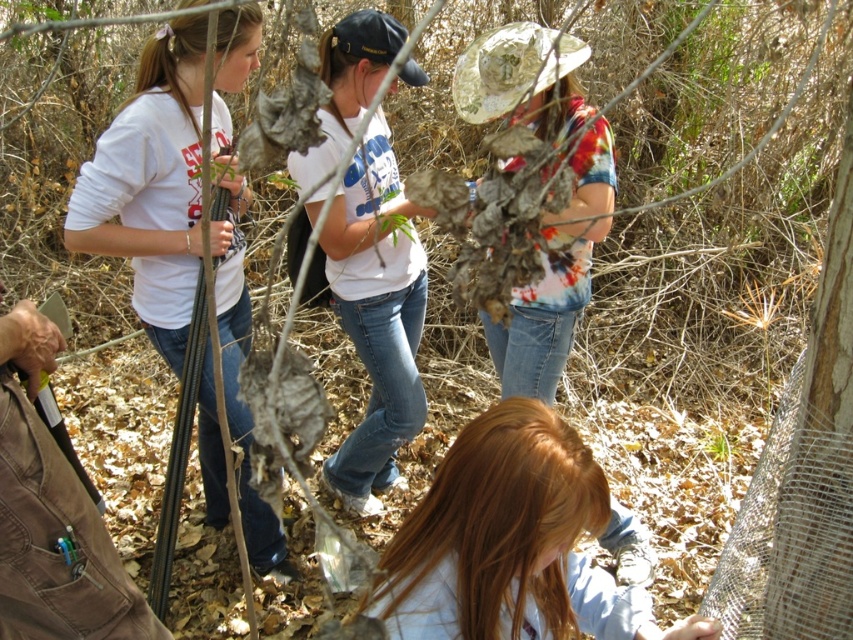
You are an observer in the scene. You notice two items in the image, the light brown hair at lower center and the printed cotton shirt at center. Which of the two is smaller in size?

The light brown hair at lower center has a smaller size compared to the printed cotton shirt at center.